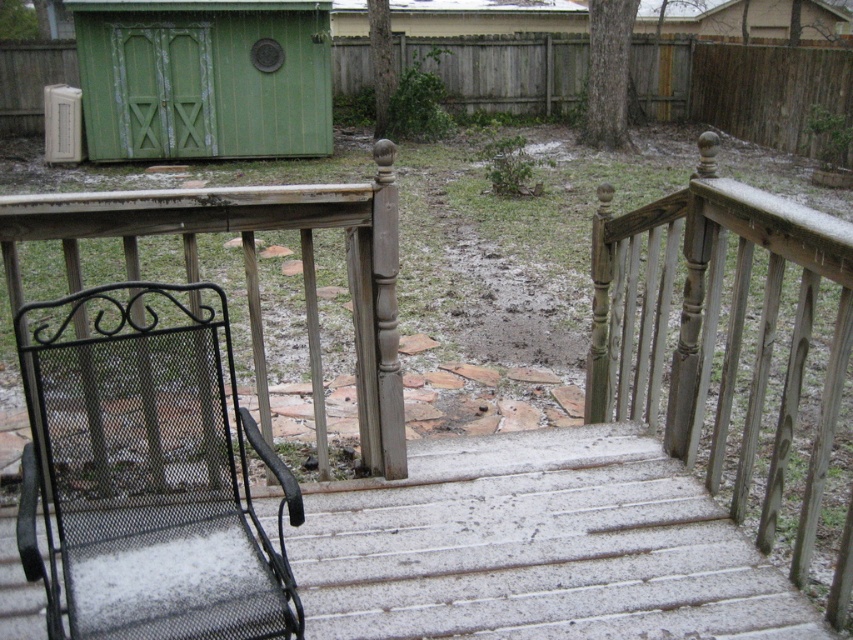
You are standing on the wooden deck and want to move towards the shed in the background. Which object, the black mesh chair at lower left or the sanded wood rail at upper right, would you encounter first while walking towards the shed?

You would encounter the black mesh chair at lower left first because it is closer to the viewer than the sanded wood rail at upper right, so it is in your path before reaching the rail.